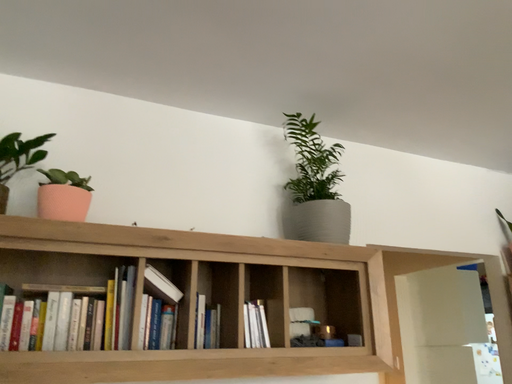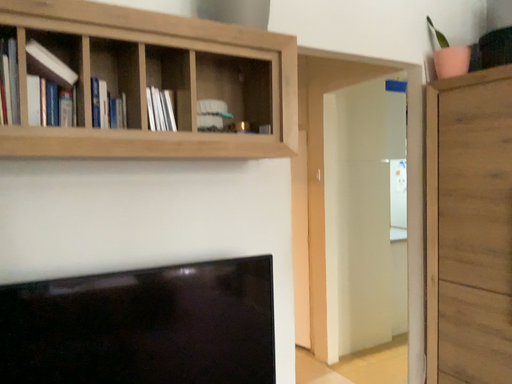
Question: How did the camera likely rotate when shooting the video?

Choices:
 (A) rotated downward
 (B) rotated upward

Answer: (A)